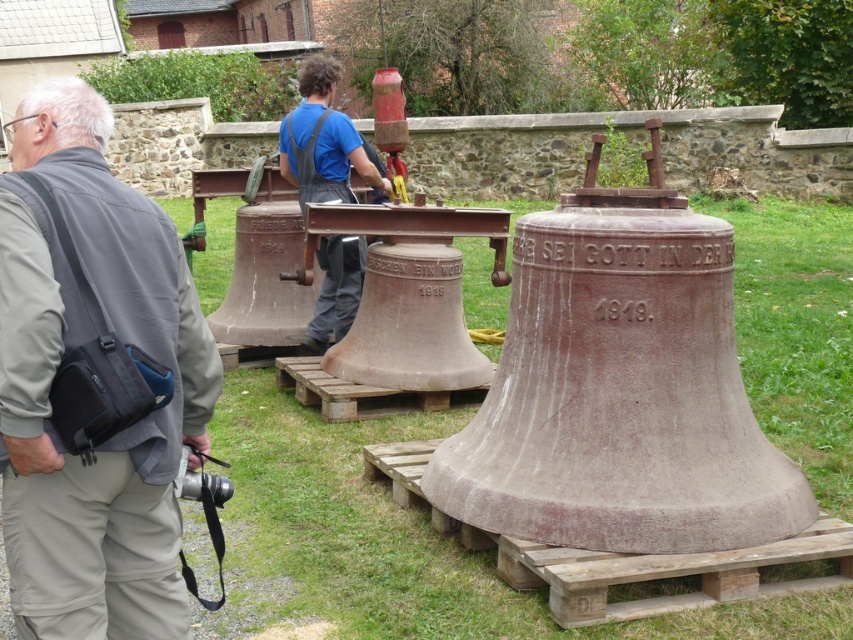
Can you confirm if gray fabric bag at lower left is bigger than blue denim overalls at center?

Yes.

Does point (172, 371) lie behind point (316, 328)?

That is False.

Is point (65, 480) positioned before point (315, 61)?

Yes, point (65, 480) is closer to viewer.

Where is `gray fabric bag at lower left`? gray fabric bag at lower left is located at coordinates (56, 368).